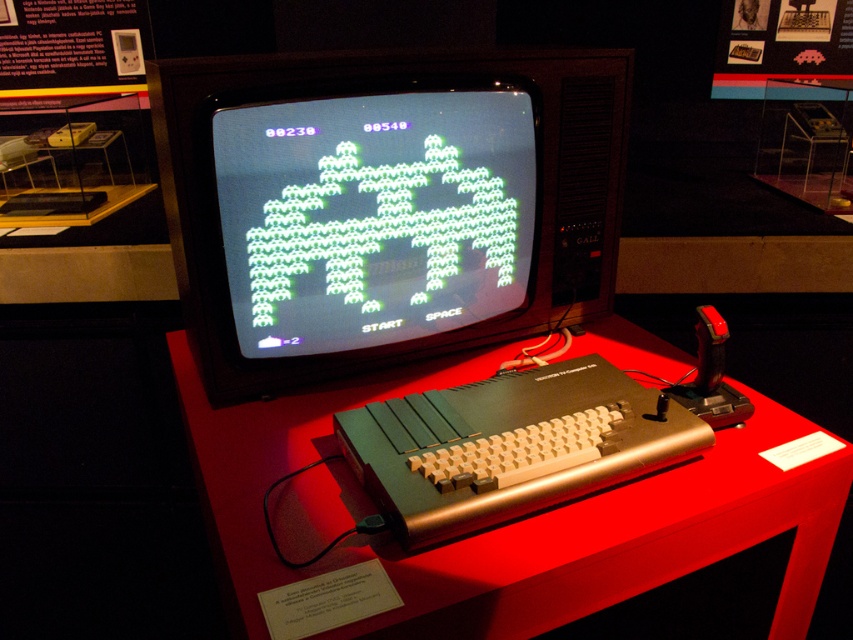
Who is positioned more to the left, black plastic monitor at center or metallic red table at center?

black plastic monitor at center is more to the left.

Is point (357, 352) less distant than point (521, 604)?

No, it is behind (521, 604).

Identify the location of black plastic monitor at center. (384, 204).